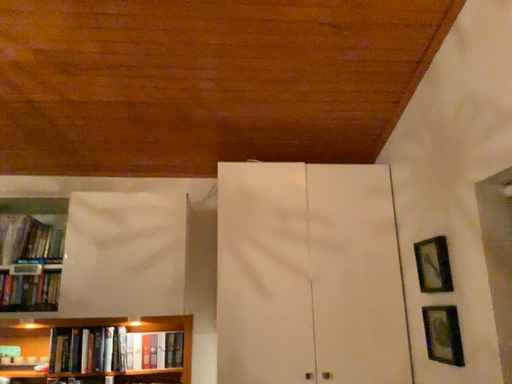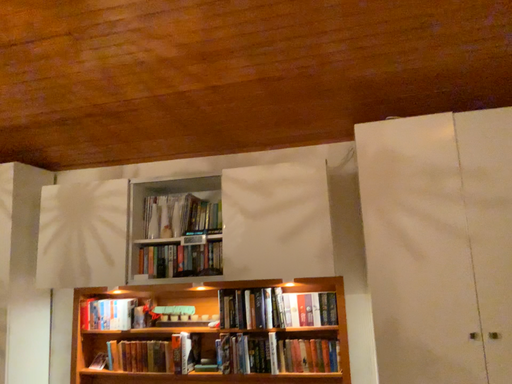
Question: Which way did the camera rotate in the video?

Choices:
 (A) rotated left
 (B) rotated right

Answer: (A)